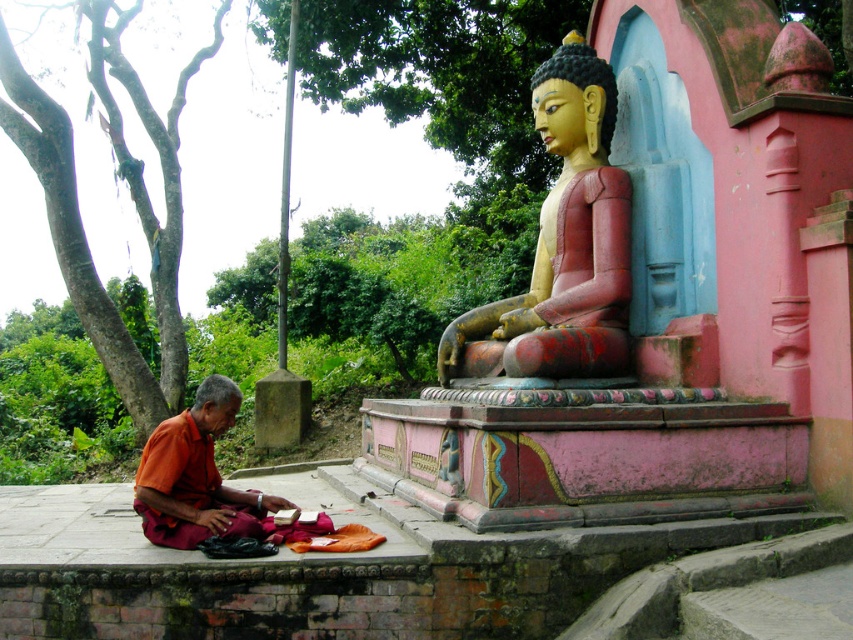
Can you confirm if polished wood statue at center is positioned to the right of orange cloth at lower left?

Yes, polished wood statue at center is to the right of orange cloth at lower left.

Is point (544, 216) positioned in front of point (258, 506)?

No, (544, 216) is further to viewer.

What are the coordinates of `polished wood statue at center` in the screenshot? It's located at (563, 243).